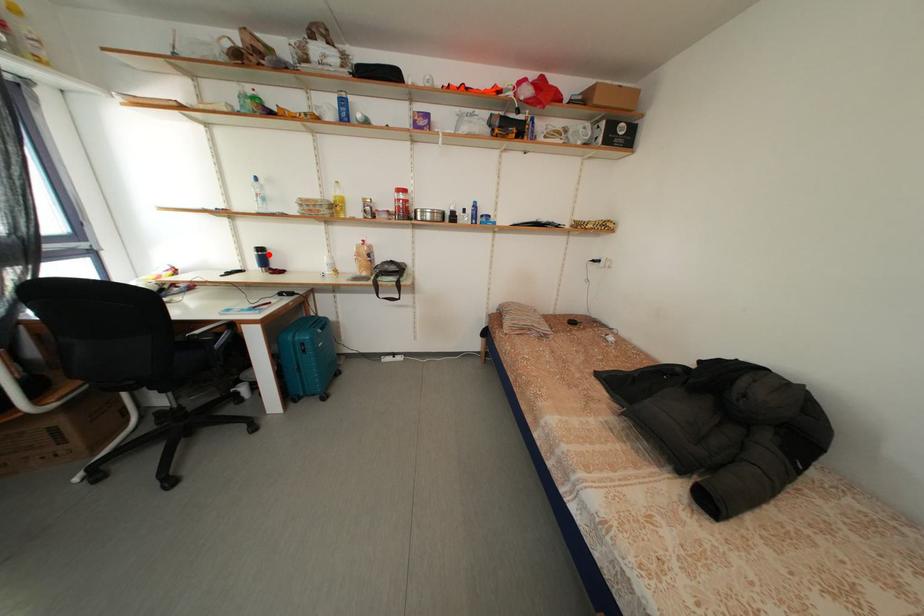
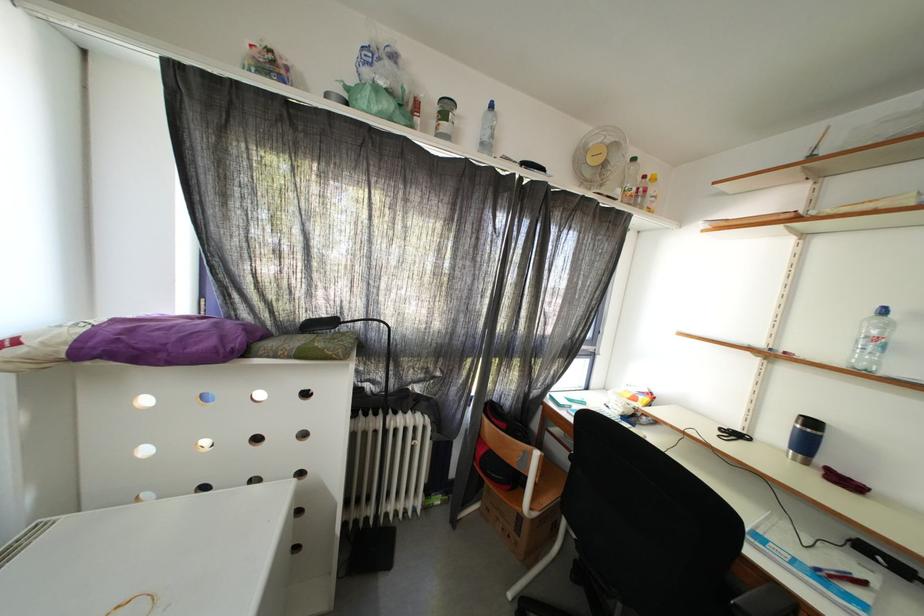
Find the pixel in the second image that matches the highlighted location in the first image.

(820, 429)